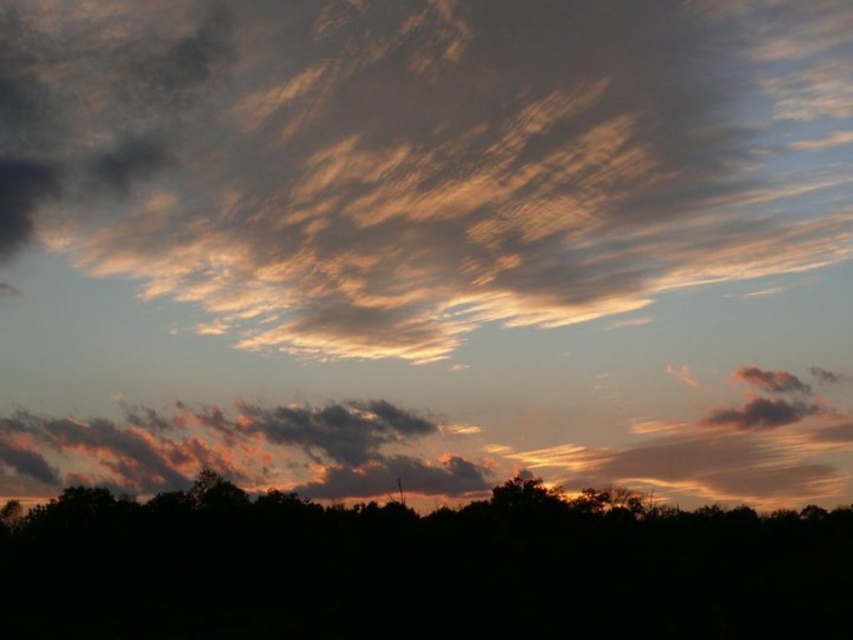
Which is behind, point (265, 60) or point (231, 616)?

Positioned behind is point (265, 60).

What are the coordinates of `golden textured clouds at upper center` in the screenshot? It's located at (424, 156).

You are a GUI agent. You are given a task and a screenshot of the screen. Output one action in this format:
    pyautogui.click(x=<x>, y=<y>)
    Task: Click on the golden textured clouds at upper center
    
    Given the screenshot: What is the action you would take?
    pyautogui.click(x=424, y=156)